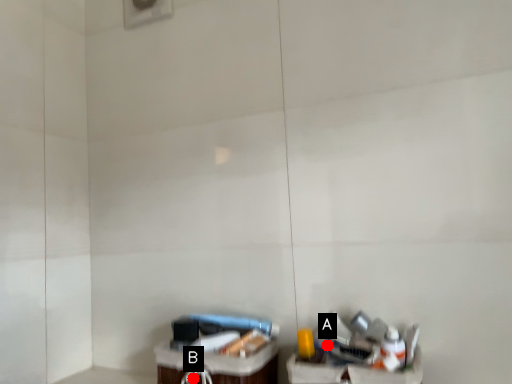
Question: Two points are circled on the image, labeled by A and B beside each circle. Which point is further to the camera?

Choices:
 (A) A is further
 (B) B is further

Answer: (B)